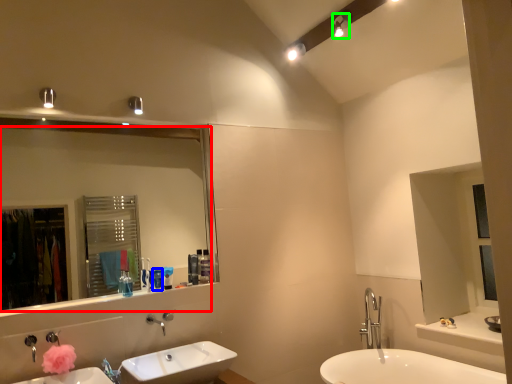
Question: Estimate the real-world distances between objects in this image. Which object is farther from mirror (highlighted by a red box), toiletry (highlighted by a blue box) or light fixture (highlighted by a green box)?

Choices:
 (A) toiletry
 (B) light fixture

Answer: (B)